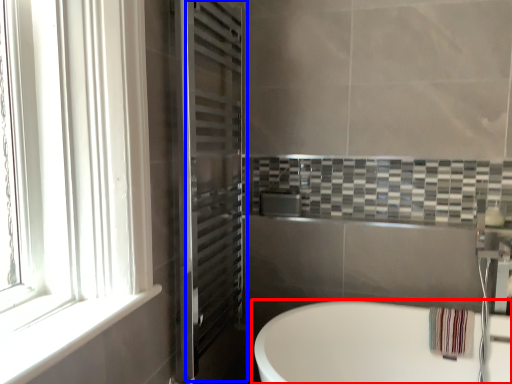
Question: Which object appears closest to the camera in this image, bathtub (highlighted by a red box) or screen door (highlighted by a blue box)?

Choices:
 (A) bathtub
 (B) screen door

Answer: (A)